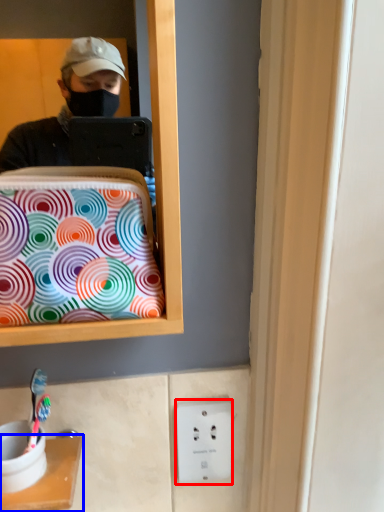
Question: Which object appears farthest to the camera in this image, electric outlet (highlighted by a red box) or furniture (highlighted by a blue box)?

Choices:
 (A) electric outlet
 (B) furniture

Answer: (A)